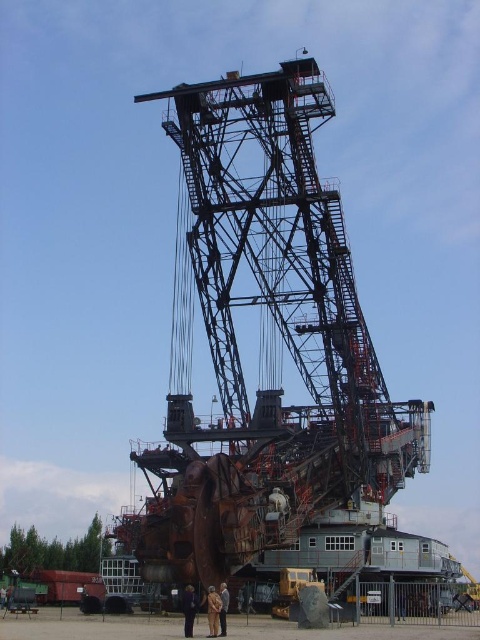
Question: Can you confirm if brown leather jacket at center is positioned to the right of dark blue fabric coat at center?

Choices:
 (A) yes
 (B) no

Answer: (A)

Question: Can you confirm if brown leather jacket at center is positioned above brown leather jacket at lower center?

Choices:
 (A) yes
 (B) no

Answer: (A)

Question: Does brown leather jacket at center appear over dark blue fabric coat at center?

Choices:
 (A) no
 (B) yes

Answer: (A)

Question: Among these points, which one is farthest from the camera?

Choices:
 (A) (217, 612)
 (B) (309, 86)
 (C) (186, 630)
 (D) (222, 589)

Answer: (B)

Question: Among these points, which one is nearest to the camera?

Choices:
 (A) (321, 275)
 (B) (223, 612)
 (C) (192, 588)
 (D) (216, 592)

Answer: (B)

Question: Among these points, which one is farthest from the camera?

Choices:
 (A) (186, 596)
 (B) (205, 600)

Answer: (B)